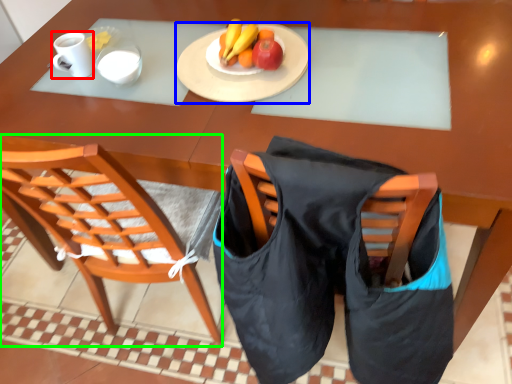
Question: Which is nearer to the coffee cup (highlighted by a red box)? plate (highlighted by a blue box) or chair (highlighted by a green box).

Choices:
 (A) plate
 (B) chair

Answer: (A)